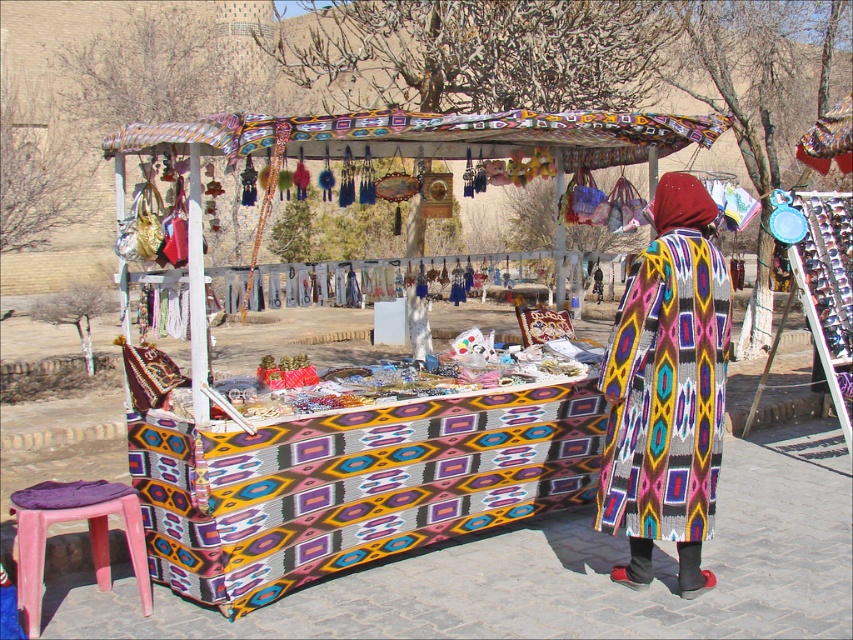
You are a customer at the market stall and want to buy the knitted woolen shawl at center. Where exactly should you look on the table to find it?

The knitted woolen shawl at center is located at point (666, 390) on the table.

You are standing at the entrance of the market and see the knitted fabric stall at center located at point (450, 456). If you want to reach this stall, which direction should you move relative to your current position?

The knitted fabric stall at center is located at point (450, 456), so you should move towards that coordinate to reach it.